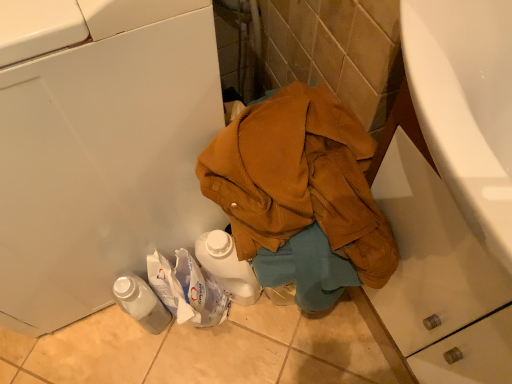
Question: Is translucent plastic bottle at lower left wider or thinner than white plastic washing machine at lower left?

Choices:
 (A) wide
 (B) thin

Answer: (B)

Question: Is translucent plastic bottle at lower left inside the boundaries of white plastic washing machine at lower left, or outside?

Choices:
 (A) inside
 (B) outside

Answer: (B)

Question: Which object is the closest to the white plastic washing machine at lower left?

Choices:
 (A) translucent plastic bottle at lower left
 (B) brown corduroy jacket at center

Answer: (B)

Question: Considering the real-world distances, which object is closest to the brown corduroy jacket at center?

Choices:
 (A) white plastic washing machine at lower left
 (B) translucent plastic bottle at lower left

Answer: (A)